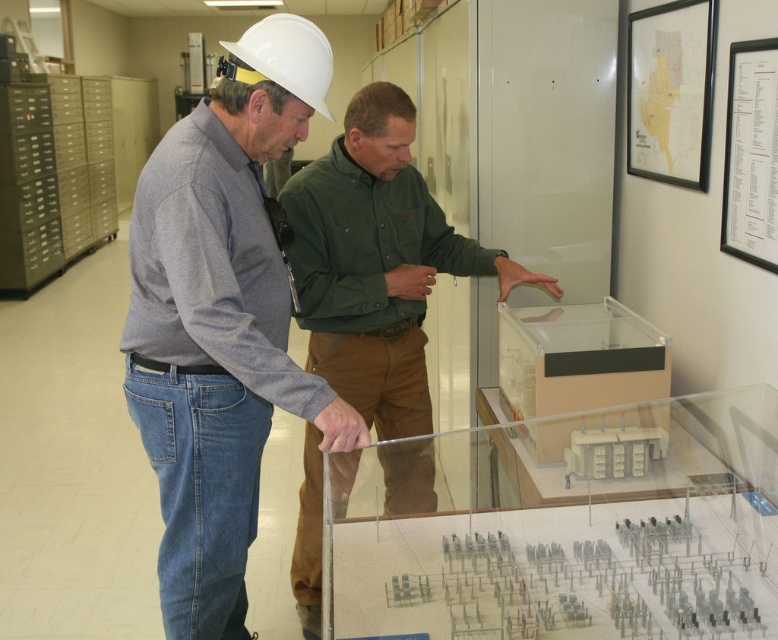
Question: Among these objects, which one is farthest from the camera?

Choices:
 (A) matte gray shirt at center
 (B) white hard hat at upper center
 (C) green matte shirt at center

Answer: (C)

Question: Can you confirm if green matte shirt at center is positioned above white hard hat at upper center?

Choices:
 (A) no
 (B) yes

Answer: (A)

Question: Does matte gray shirt at center have a lesser width compared to green matte shirt at center?

Choices:
 (A) yes
 (B) no

Answer: (A)

Question: Can you confirm if green matte shirt at center is positioned above white hard hat at upper center?

Choices:
 (A) yes
 (B) no

Answer: (B)

Question: Which object appears farthest from the camera in this image?

Choices:
 (A) white hard hat at upper center
 (B) matte gray shirt at center
 (C) green matte shirt at center

Answer: (C)

Question: Among these points, which one is nearest to the camera?

Choices:
 (A) (244, 54)
 (B) (398, 349)
 (C) (184, 620)

Answer: (A)